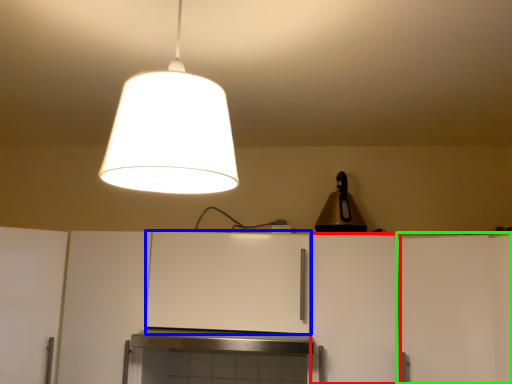
Question: Which object is positioned closest to cabinetry (highlighted by a red box)? Select from cabinetry (highlighted by a blue box) and cabinetry (highlighted by a green box).

Choices:
 (A) cabinetry
 (B) cabinetry

Answer: (B)